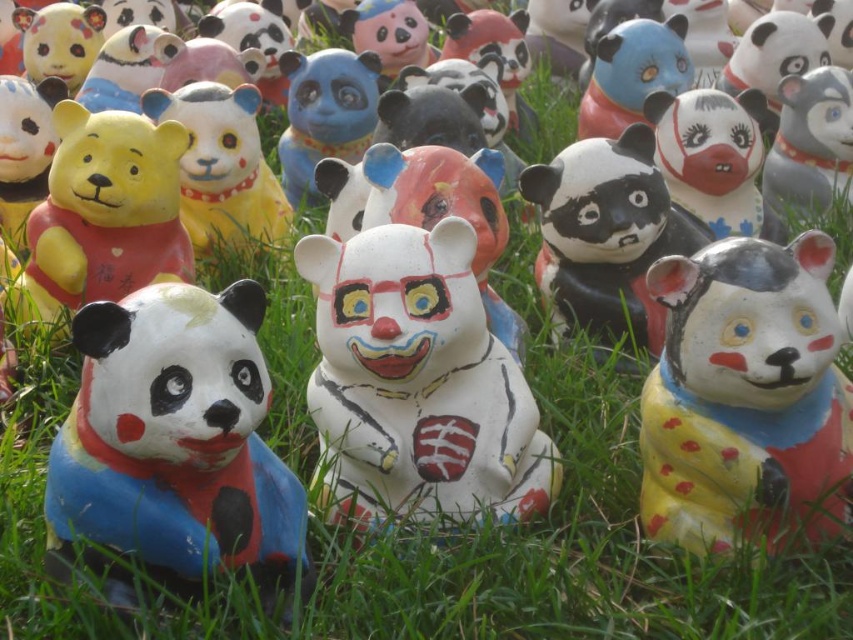
Question: Which of the following is the farthest from the observer?

Choices:
 (A) (412, 237)
 (B) (601, 163)
 (C) (161, 349)

Answer: (B)

Question: Among these objects, which one is nearest to the camera?

Choices:
 (A) yellow matte bear at center
 (B) white glossy panda at center
 (C) matte painted panda at lower left

Answer: (C)

Question: Considering the real-world distances, which object is farthest from the matte painted panda at lower left?

Choices:
 (A) white glossy panda at center
 (B) white matte clown bear at center

Answer: (A)

Question: Is matte painted panda at lower left closer to camera compared to yellow matte bear at center?

Choices:
 (A) no
 (B) yes

Answer: (B)

Question: Does matte ceramic bear at lower right appear on the left side of white glossy panda at center?

Choices:
 (A) no
 (B) yes

Answer: (A)

Question: Does white matte clown bear at center come behind matte ceramic bear at lower right?

Choices:
 (A) yes
 (B) no

Answer: (A)